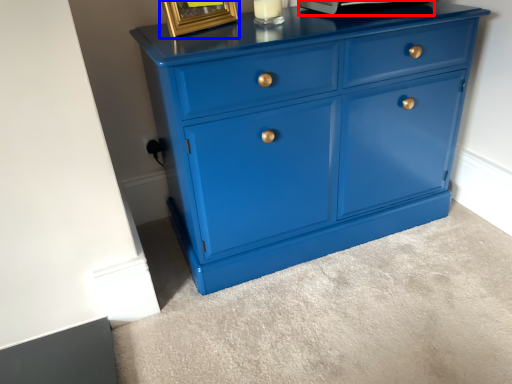
Question: Which object is further to the camera taking this photo, appliance (highlighted by a red box) or picture frame (highlighted by a blue box)?

Choices:
 (A) appliance
 (B) picture frame

Answer: (A)